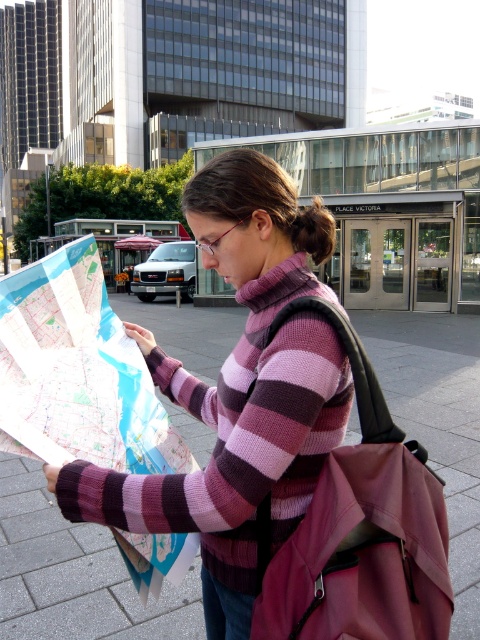
The person is holding a paper map at center and has brown hair at center. Which object is higher in the image?

The brown hair at center is higher in the image because the paper map at center is positioned under it.

You are standing 1.15 meters away from the striped sweater at center. If you want to hand the person a brochure, can you reach them without moving closer?

The striped sweater at center and viewer are 1.15 meters apart, so you can reach them without moving closer as the typical human arm length is around 0.7 meters.